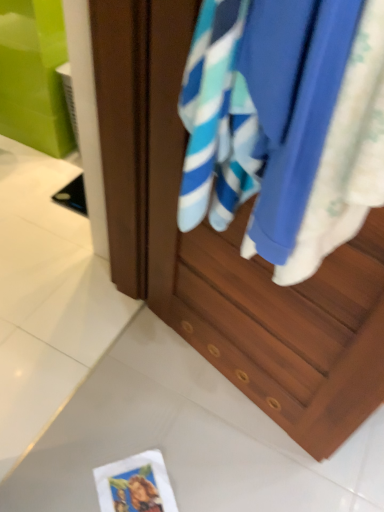
At what (x,y) coordinates should I click in order to perform the action: click on white glossy tile at lower center. Please return your answer as a coordinate pair (x, y). Looking at the image, I should click on (190, 443).

Where is `white paper postcard at lower center`? This screenshot has width=384, height=512. white paper postcard at lower center is located at coordinates (135, 484).

Considering the sizes of objects white glossy tile at lower center and wooden cabinet at center in the image provided, who is shorter, white glossy tile at lower center or wooden cabinet at center?

white glossy tile at lower center is shorter.

Where is `tile behind the wooden cabinet at center`? Image resolution: width=384 pixels, height=512 pixels. tile behind the wooden cabinet at center is located at coordinates (190, 443).

Are white glossy tile at lower center and wooden cabinet at center beside each other?

No.

In the scene shown: Is wooden cabinet at center in contact with white glossy tile at lower center?

No, wooden cabinet at center is not beside white glossy tile at lower center.

In the scene shown: Which of these two, wooden cabinet at center or white glossy tile at lower center, is wider?

white glossy tile at lower center.

Would you say wooden cabinet at center is inside or outside white glossy tile at lower center?

The correct answer is: outside.

From a real-world perspective, which is physically below, wooden cabinet at center or white glossy tile at lower center?

white glossy tile at lower center, from a real-world perspective.

In terms of height, does white paper postcard at lower center look taller or shorter compared to white glossy tile at lower center?

Considering their sizes, white paper postcard at lower center has less height than white glossy tile at lower center.

Considering the relative sizes of white paper postcard at lower center and white glossy tile at lower center in the image provided, is white paper postcard at lower center bigger than white glossy tile at lower center?

No.

Would you say white paper postcard at lower center is to the left or to the right of white glossy tile at lower center in the picture?

From the image, it's evident that white paper postcard at lower center is to the left of white glossy tile at lower center.

Where is `tile lying on the right of white paper postcard at lower center`? tile lying on the right of white paper postcard at lower center is located at coordinates (190, 443).

Which object is thinner, white glossy tile at lower center or blue cotton towel at center?

blue cotton towel at center.

How far apart are white glossy tile at lower center and blue cotton towel at center?

They are 35.36 inches apart.

How different are the orientations of white glossy tile at lower center and blue cotton towel at center in degrees?

The angular difference between white glossy tile at lower center and blue cotton towel at center is 86.9 degrees.

From a real-world perspective, which is physically above, white glossy tile at lower center or blue cotton towel at center?

In real-world perspective, blue cotton towel at center is above.

From the picture: Which of these two, wooden cabinet at center or blue cotton towel at center, is smaller?

blue cotton towel at center is smaller.

Does wooden cabinet at center have a greater height compared to blue cotton towel at center?

Indeed, wooden cabinet at center has a greater height compared to blue cotton towel at center.

Which is correct: wooden cabinet at center is inside blue cotton towel at center, or outside of it?

wooden cabinet at center is spatially situated outside blue cotton towel at center.

Considering the points (153, 305) and (365, 163), which point is behind, point (153, 305) or point (365, 163)?

Positioned behind is point (153, 305).

Considering the sizes of white paper postcard at lower center and blue cotton towel at center in the image, is white paper postcard at lower center wider or thinner than blue cotton towel at center?

In the image, white paper postcard at lower center appears to be wider than blue cotton towel at center.

Choose the correct answer: Is white paper postcard at lower center inside blue cotton towel at center or outside it?

white paper postcard at lower center is outside blue cotton towel at center.

Considering the sizes of objects white paper postcard at lower center and blue cotton towel at center in the image provided, who is taller, white paper postcard at lower center or blue cotton towel at center?

Standing taller between the two is blue cotton towel at center.

Does point (161, 473) appear closer or farther from the camera than point (340, 95)?

Point (161, 473) is farther from the camera than point (340, 95).

Considering the relative sizes of blue cotton towel at center and white glossy tile at lower center in the image provided, is blue cotton towel at center shorter than white glossy tile at lower center?

No, blue cotton towel at center is not shorter than white glossy tile at lower center.

Consider the image. Between blue cotton towel at center and white glossy tile at lower center, which one has larger width?

Wider between the two is white glossy tile at lower center.

Which object is positioned more to the right, blue cotton towel at center or white glossy tile at lower center?

blue cotton towel at center.

Where is `tile below the wooden cabinet at center (from a real-world perspective)`? tile below the wooden cabinet at center (from a real-world perspective) is located at coordinates (190, 443).

This screenshot has width=384, height=512. I want to click on cabinetry above the white glossy tile at lower center (from the image's perspective), so click(x=227, y=248).

Looking at the image, which one is located further to wooden cabinet at center, white paper postcard at lower center or white glossy tile at lower center?

white paper postcard at lower center.

When comparing their distances from white glossy tile at lower center, does blue cotton towel at center or white paper postcard at lower center seem closer?

white paper postcard at lower center.

Looking at this image, from the image, which object appears to be farther from white paper postcard at lower center, white glossy tile at lower center or blue cotton towel at center?

blue cotton towel at center is further to white paper postcard at lower center.

Which object lies nearer to the anchor point white glossy tile at lower center, blue cotton towel at center or wooden cabinet at center?

wooden cabinet at center is closer to white glossy tile at lower center.

From the image, which object appears to be nearer to blue cotton towel at center, white paper postcard at lower center or white glossy tile at lower center?

white glossy tile at lower center.

Which object lies nearer to the anchor point white paper postcard at lower center, white glossy tile at lower center or wooden cabinet at center?

The object closer to white paper postcard at lower center is white glossy tile at lower center.

Based on the photo, estimate the real-world distances between objects in this image. Which object is further from wooden cabinet at center, white paper postcard at lower center or blue cotton towel at center?

white paper postcard at lower center is further to wooden cabinet at center.

When comparing their distances from wooden cabinet at center, does white glossy tile at lower center or white paper postcard at lower center seem further?

Based on the image, white paper postcard at lower center appears to be further to wooden cabinet at center.

Where is `tile between blue cotton towel at center and white paper postcard at lower center in the vertical direction`? The image size is (384, 512). tile between blue cotton towel at center and white paper postcard at lower center in the vertical direction is located at coordinates [190, 443].

Locate an element on the screen. This screenshot has width=384, height=512. tile between wooden cabinet at center and white paper postcard at lower center in the vertical direction is located at coordinates (190, 443).

Identify the location of cabinetry between blue cotton towel at center and white paper postcard at lower center vertically. (227, 248).

This screenshot has height=512, width=384. Identify the location of cabinetry between blue cotton towel at center and white glossy tile at lower center in the up-down direction. (227, 248).